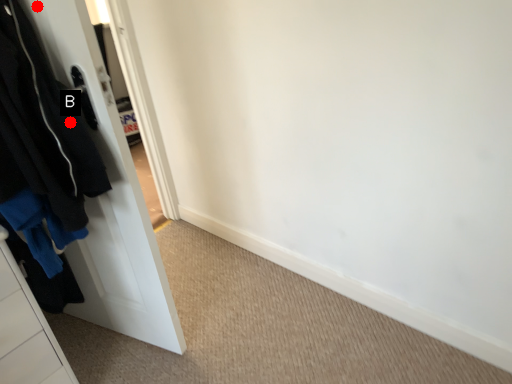
Question: Two points are circled on the image, labeled by A and B beside each circle. Which of the following is the farthest from the observer?

Choices:
 (A) A is further
 (B) B is further

Answer: (B)